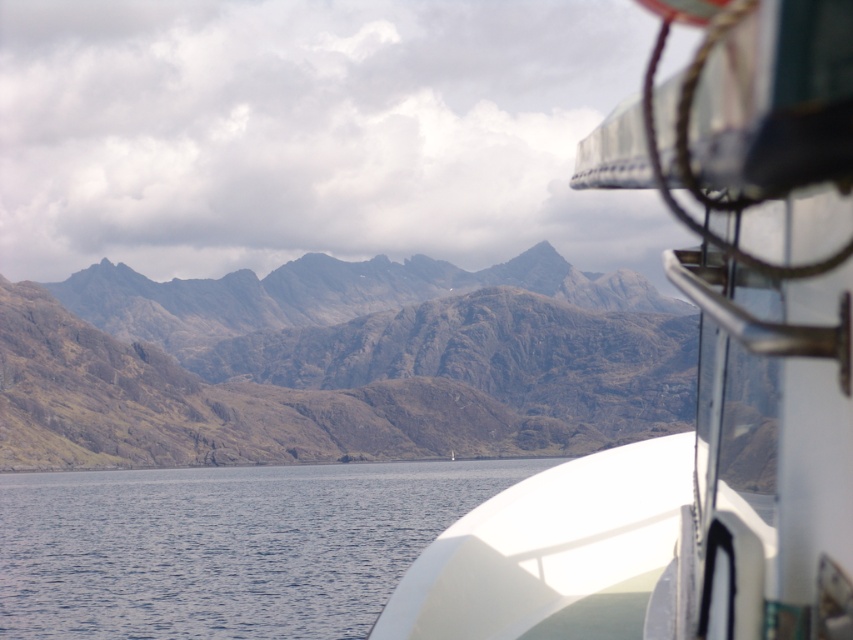
You are standing on the deck of the boat and want to take a photo that includes both the white glossy boat at upper right and the blue water at lower left. Which object should you focus on first to ensure both are in sharp focus?

You should focus on the white glossy boat at upper right first because it is closer to the viewer than the blue water at lower left, so adjusting focus from near to far will help both be in focus.

You are standing on the deck of the boat and looking out towards the mountains. There is a point marked at coordinates (701, 372). What object is located at that point?

The point at coordinates (701, 372) corresponds to the white glossy boat at upper right.